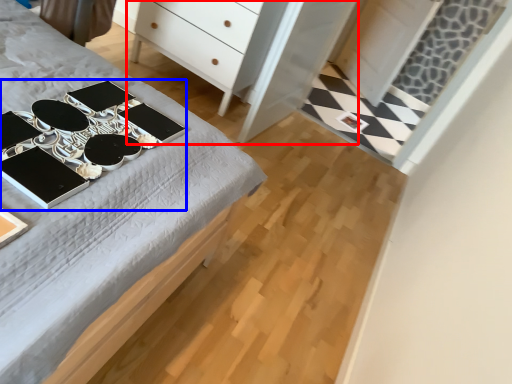
Question: Which point is closer to the camera, dresser (highlighted by a red box) or changing table (highlighted by a blue box)?

Choices:
 (A) dresser
 (B) changing table

Answer: (B)